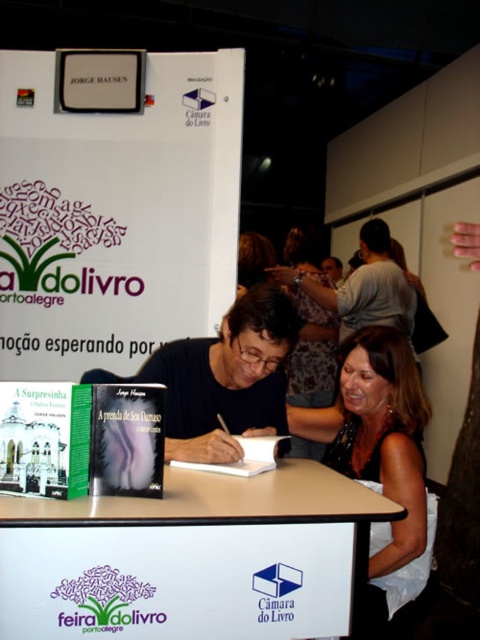
You are organizing a book signing event and need to place a large banner on the surface that can accommodate it. Which object between the white paperboard at upper center and the white wood table at center would be more suitable for this purpose?

The white paperboard at upper center is larger in size than the white wood table at center, making it more suitable for placing a large banner.

You are an attendee at the book fair and want to place a book on the white paperboard at upper center and the white wood table at center. Which surface is higher?

The white paperboard at upper center is above the white wood table at center, so it is higher.